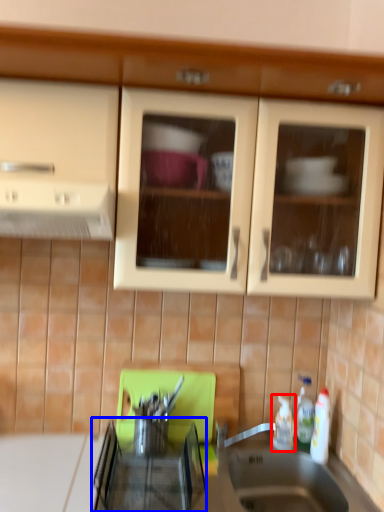
Question: Among these objects, which one is farthest to the camera, bottle (highlighted by a red box) or appliance (highlighted by a blue box)?

Choices:
 (A) bottle
 (B) appliance

Answer: (A)